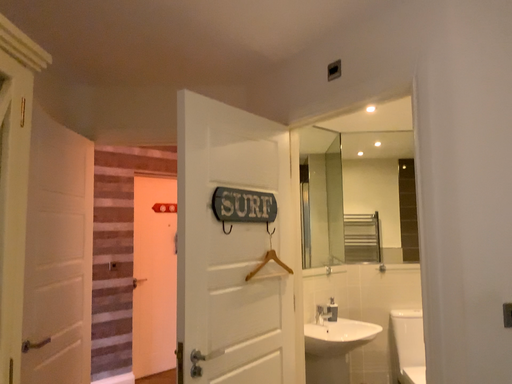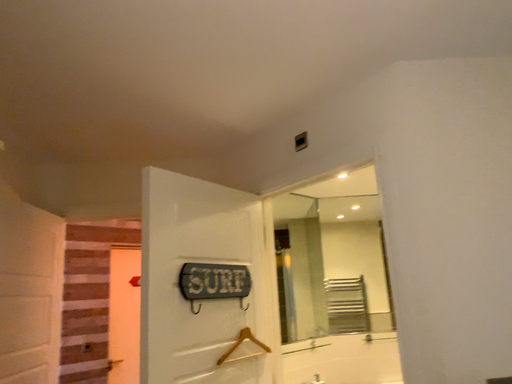
Question: Which way did the camera rotate in the video?

Choices:
 (A) rotated upward
 (B) rotated downward

Answer: (A)